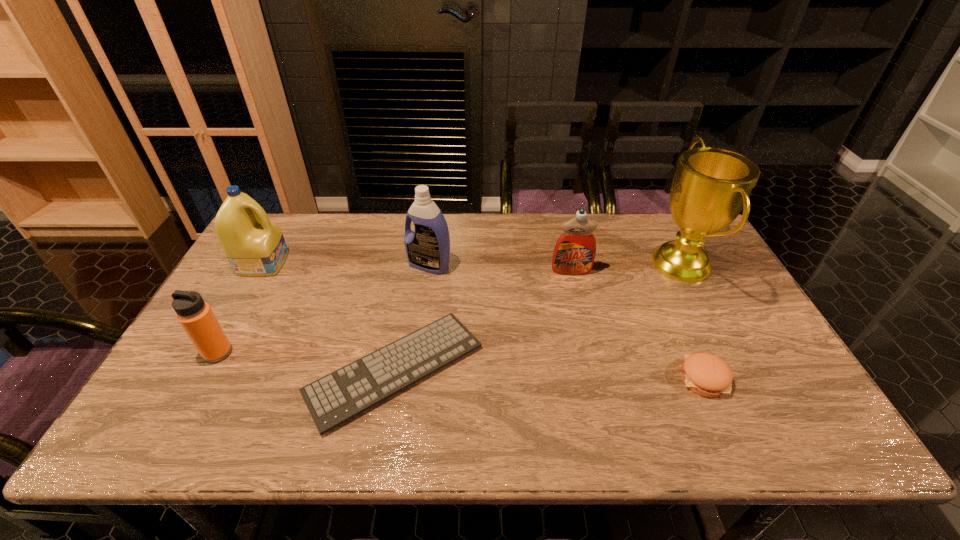
Locate an element on the screen. The height and width of the screenshot is (540, 960). vacant space that's between the second detergent from right to left and the leftmost detergent is located at coordinates click(x=347, y=264).

I want to click on vacant point located between the thermos bottle and the shortest detergent, so click(x=395, y=312).

Where is `free spot between the second shortest object and the leftmost detergent`? The height and width of the screenshot is (540, 960). free spot between the second shortest object and the leftmost detergent is located at coordinates (484, 320).

This screenshot has height=540, width=960. In order to click on vacant area between the computer keyboard and the rightmost detergent in this screenshot , I will do `click(483, 320)`.

Locate an element on the screen. free space that is in between the shortest detergent and the thermos bottle is located at coordinates (395, 312).

Find the location of a particular element. The height and width of the screenshot is (540, 960). vacant area between the computer keyboard and the leftmost detergent is located at coordinates (329, 316).

What are the coordinates of `unoccupied area between the rightmost detergent and the tallest object` in the screenshot? It's located at (627, 267).

Where is `free spot between the sixth tallest object and the second detergent from right to left`? The width and height of the screenshot is (960, 540). free spot between the sixth tallest object and the second detergent from right to left is located at coordinates (566, 322).

Where is `object that is the fourth nearest to the leftmost detergent`? Image resolution: width=960 pixels, height=540 pixels. object that is the fourth nearest to the leftmost detergent is located at coordinates (574, 253).

You are a GUI agent. You are given a task and a screenshot of the screen. Output one action in this format:
    pyautogui.click(x=<x>, y=<y>)
    Task: Click on the object identified as the second closest to the rightmost detergent
    
    Given the screenshot: What is the action you would take?
    pyautogui.click(x=332, y=400)